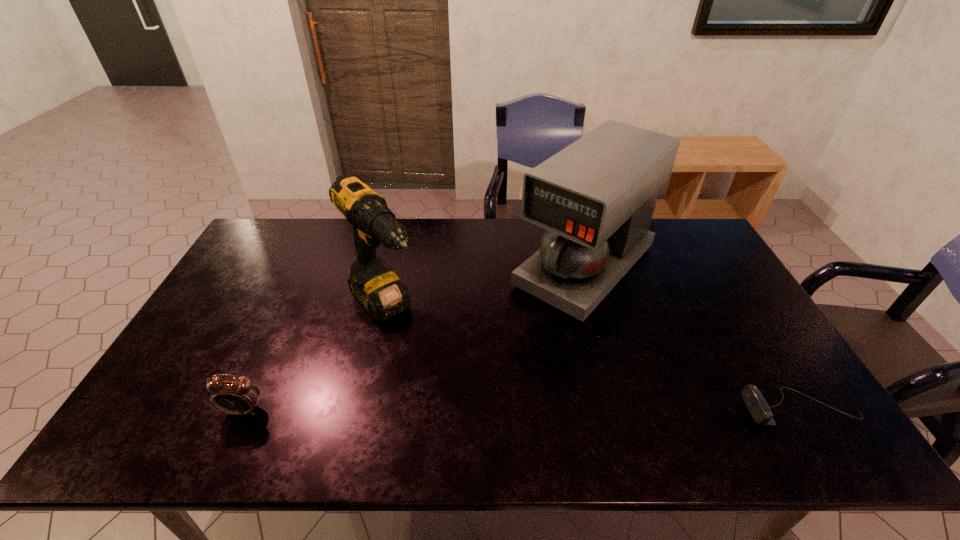
Find the location of a particular element. This screenshot has width=960, height=540. free space located on the carafe side of the coffee maker is located at coordinates (534, 320).

At what (x,y) coordinates should I click in order to perform the action: click on vacant space situated on the carafe side of the coffee maker. Please return your answer as a coordinate pair (x, y). This screenshot has width=960, height=540. Looking at the image, I should click on (504, 349).

Locate an element on the screen. This screenshot has width=960, height=540. blank space located at the tip of the second object from left to right is located at coordinates (458, 387).

I want to click on vacant space located 0.070m at the tip of the second object from left to right, so click(x=421, y=349).

Find the location of a particular element. free space located 0.190m at the tip of the second object from left to right is located at coordinates (x=448, y=377).

This screenshot has height=540, width=960. I want to click on object located in the far edge section of the desktop, so click(x=596, y=197).

Identify the location of alarm clock that is at the near edge. The height and width of the screenshot is (540, 960). (234, 395).

Where is `webcam present at the near edge`? The image size is (960, 540). webcam present at the near edge is located at coordinates (759, 409).

Identify the location of object that is at the right edge. (759, 409).

Find the location of a particular element. Image resolution: width=960 pixels, height=540 pixels. object that is at the near right corner is located at coordinates (759, 409).